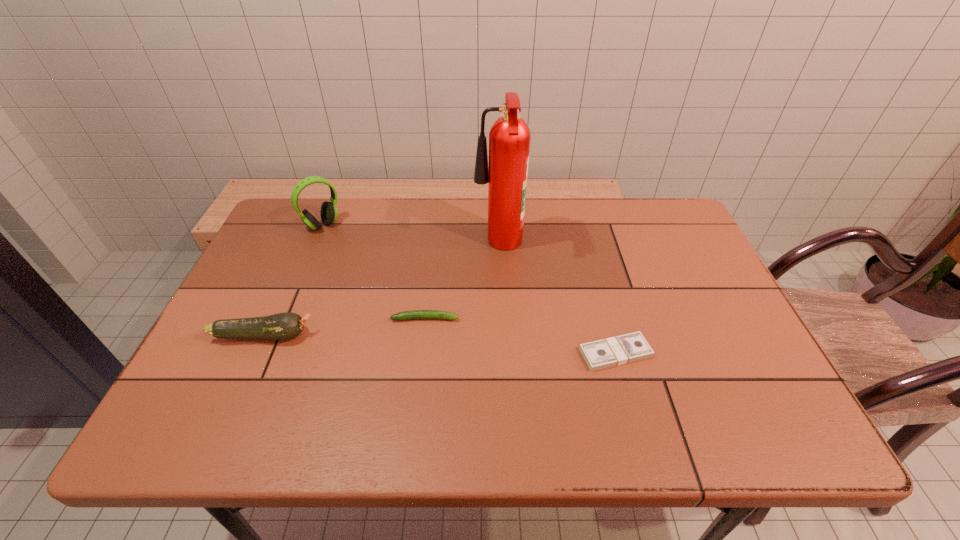
The image size is (960, 540). Find the location of `free space located 0.370m at the nozzle of the fire extinguisher`. free space located 0.370m at the nozzle of the fire extinguisher is located at coordinates (347, 247).

Locate an element on the screen. The image size is (960, 540). blank space located at the nozzle of the fire extinguisher is located at coordinates (392, 247).

You are a GUI agent. You are given a task and a screenshot of the screen. Output one action in this format:
    pyautogui.click(x=<x>, y=<y>)
    Task: Click on the blank space located 0.130m on the right of the headset
    This screenshot has width=960, height=540.
    Given the screenshot: What is the action you would take?
    pyautogui.click(x=384, y=225)

Where is `vacant space located 0.080m at the blossom end of the third tallest object`? vacant space located 0.080m at the blossom end of the third tallest object is located at coordinates (348, 335).

Locate an element on the screen. The width and height of the screenshot is (960, 540). vacant space located on the front-facing side of the fourth tallest object is located at coordinates (532, 319).

You are a GUI agent. You are given a task and a screenshot of the screen. Output one action in this format:
    pyautogui.click(x=<x>, y=<y>)
    Task: Click on the vacant region located 0.280m on the back of the shortest object
    Image resolution: width=960 pixels, height=540 pixels.
    Given the screenshot: What is the action you would take?
    pyautogui.click(x=589, y=258)

Find the location of a particular element. The height and width of the screenshot is (540, 960). fire extinguisher present at the far edge is located at coordinates coord(509,138).

Locate an element on the screen. headset present at the far edge is located at coordinates (328, 212).

The width and height of the screenshot is (960, 540). I want to click on headset located in the left edge section of the desktop, so click(x=328, y=212).

Locate an element on the screen. zucchini positioned at the left edge is located at coordinates (283, 326).